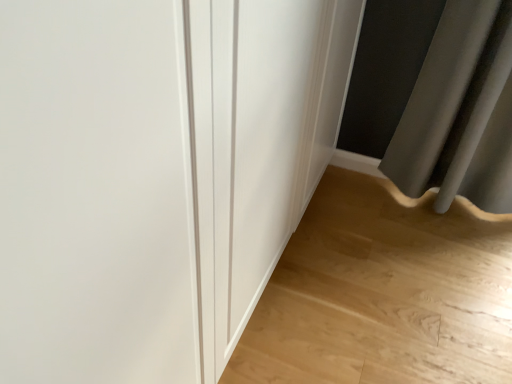
Question: Is light wood floor at lower right to the left or to the right of white smooth door at center in the image?

Choices:
 (A) right
 (B) left

Answer: (A)

Question: From a real-world perspective, is light wood floor at lower right physically located above or below white smooth door at center?

Choices:
 (A) above
 (B) below

Answer: (B)

Question: Considering the positions of light wood floor at lower right and white smooth door at center in the image, is light wood floor at lower right bigger or smaller than white smooth door at center?

Choices:
 (A) big
 (B) small

Answer: (B)

Question: Considering the positions of white smooth door at center and light wood floor at lower right in the image, is white smooth door at center bigger or smaller than light wood floor at lower right?

Choices:
 (A) small
 (B) big

Answer: (B)

Question: In the image, is white smooth door at center on the left side or the right side of light wood floor at lower right?

Choices:
 (A) left
 (B) right

Answer: (A)

Question: In terms of height, does white smooth door at center look taller or shorter compared to light wood floor at lower right?

Choices:
 (A) tall
 (B) short

Answer: (A)

Question: Is point (175, 365) closer or farther from the camera than point (349, 246)?

Choices:
 (A) farther
 (B) closer

Answer: (B)